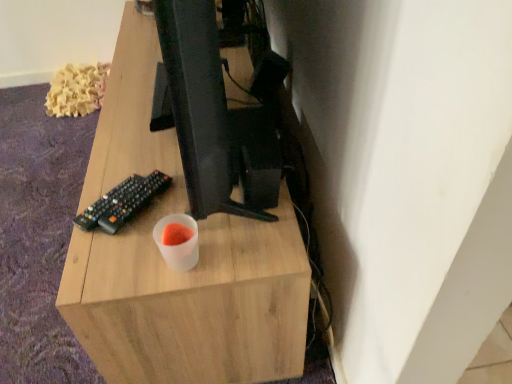
Question: Is light wood desk at center taller or shorter than black plastic remote control at lower left?

Choices:
 (A) tall
 (B) short

Answer: (A)

Question: From a real-world perspective, is light wood desk at center physically located above or below black plastic remote control at lower left?

Choices:
 (A) above
 (B) below

Answer: (B)

Question: Based on their positions, is light wood desk at center located to the left or right of black plastic remote control at lower left?

Choices:
 (A) left
 (B) right

Answer: (B)

Question: In terms of size, does black plastic remote control at lower left appear bigger or smaller than light wood desk at center?

Choices:
 (A) small
 (B) big

Answer: (A)

Question: Considering the positions of black plastic remote control at lower left and light wood desk at center in the image, is black plastic remote control at lower left wider or thinner than light wood desk at center?

Choices:
 (A) thin
 (B) wide

Answer: (A)

Question: In terms of height, does black plastic remote control at lower left look taller or shorter compared to light wood desk at center?

Choices:
 (A) short
 (B) tall

Answer: (A)

Question: From the image's perspective, is black plastic remote control at lower left located above or below light wood desk at center?

Choices:
 (A) below
 (B) above

Answer: (A)